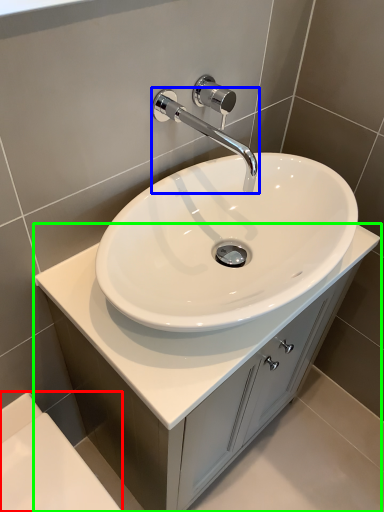
Question: Which object is positioned farthest from bath (highlighted by a red box)? Select from tap (highlighted by a blue box) and bathroom cabinet (highlighted by a green box).

Choices:
 (A) tap
 (B) bathroom cabinet

Answer: (A)